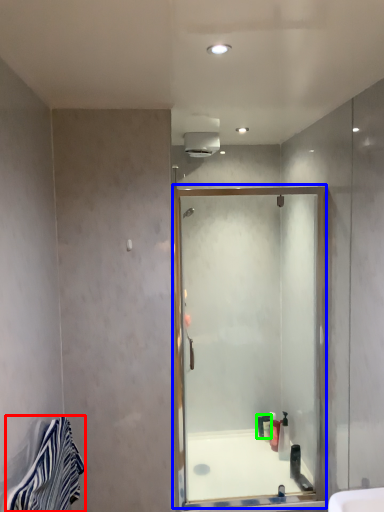
Question: Which is nearer to the material (highlighted by a red box)? screen door (highlighted by a blue box) or toiletry (highlighted by a green box).

Choices:
 (A) screen door
 (B) toiletry

Answer: (A)